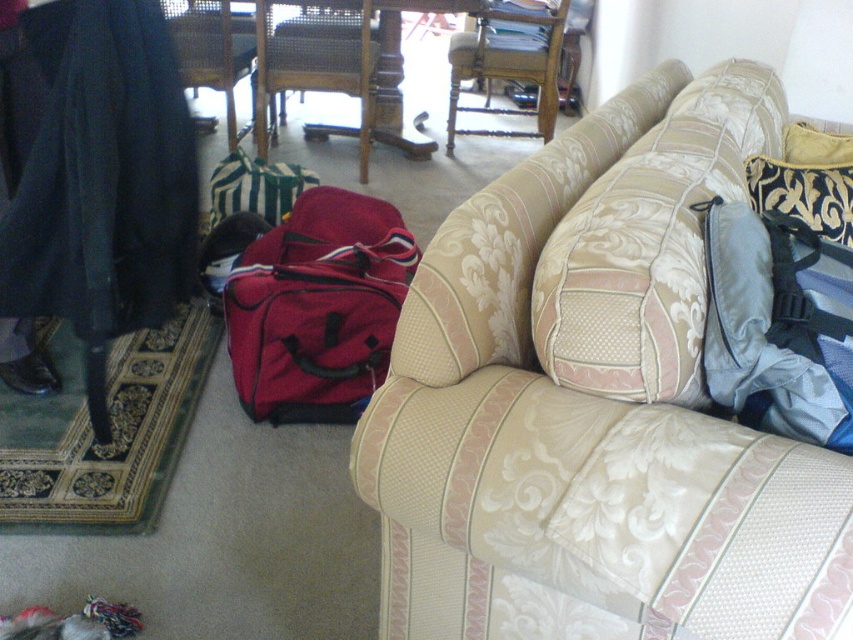
Does blue fabric bag at right have a lesser height compared to wooden woven armchair at center?

Correct, blue fabric bag at right is not as tall as wooden woven armchair at center.

Is blue fabric bag at right wider than wooden woven armchair at center?

In fact, blue fabric bag at right might be narrower than wooden woven armchair at center.

Where is `blue fabric bag at right`? blue fabric bag at right is located at coordinates (778, 324).

Which is behind, point (392, 285) or point (792, 202)?

The point (392, 285) is more distant.

Who is positioned more to the left, matte red duffel at center or black velvet pillow at upper right?

matte red duffel at center

At what (x,y) coordinates should I click in order to perform the action: click on matte red duffel at center. Please return your answer as a coordinate pair (x, y). The height and width of the screenshot is (640, 853). Looking at the image, I should click on (317, 307).

Is blue fabric bag at right below velvet gold pillow at right?

Indeed, blue fabric bag at right is positioned under velvet gold pillow at right.

In order to click on blue fabric bag at right in this screenshot , I will do `click(778, 324)`.